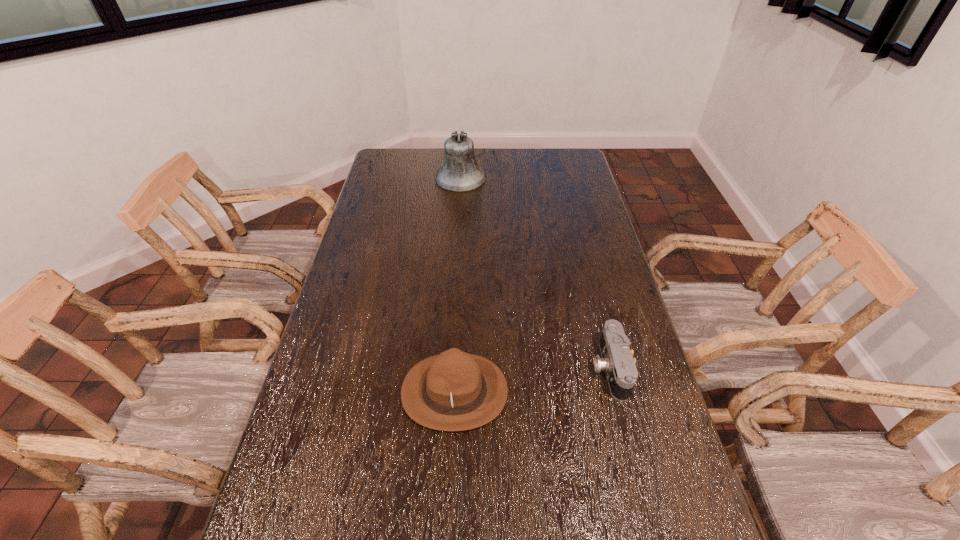
Where is `free space between the bell and the second tallest object`? free space between the bell and the second tallest object is located at coordinates (458, 285).

Locate an element on the screen. free space between the shortest object and the bell is located at coordinates (535, 273).

I want to click on free area in between the tallest object and the shortest object, so click(535, 273).

The image size is (960, 540). Identify the location of free space between the camera and the second tallest object. (532, 380).

Identify the location of object that stands as the second closest to the second shortest object. Image resolution: width=960 pixels, height=540 pixels. (460, 172).

Identify which object is located as the second nearest to the rightmost object. Please provide its 2D coordinates. Your answer should be formatted as a tuple, i.e. [(x, y)], where the tuple contains the x and y coordinates of a point satisfying the conditions above.

[(460, 172)]